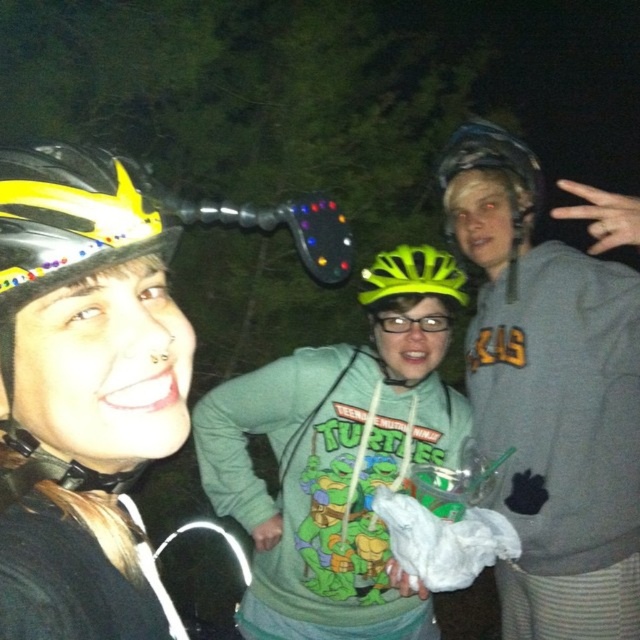
You are a photographer trying to capture all three people in a single shot. The gray matte sweatshirt at center and the yellow matte bicycle helmet at left are in your current frame. Since you want to include everyone, will adjusting the camera angle upwards help you include the person on the right?

The gray matte sweatshirt at center is much taller than the yellow matte bicycle helmet at left, so adjusting the camera angle upwards might not effectively include the person on the right. Focus on widening the frame or moving closer to ensure all three are visible.

You are a photographer at the nighttime cycling event. You want to take a photo of the yellow shiny helmet at left and the yellow matte bicycle helmet at left. Which one will appear closer to the camera in the photo?

The yellow shiny helmet at left will appear closer to the camera in the photo because it is in front of the yellow matte bicycle helmet at left.